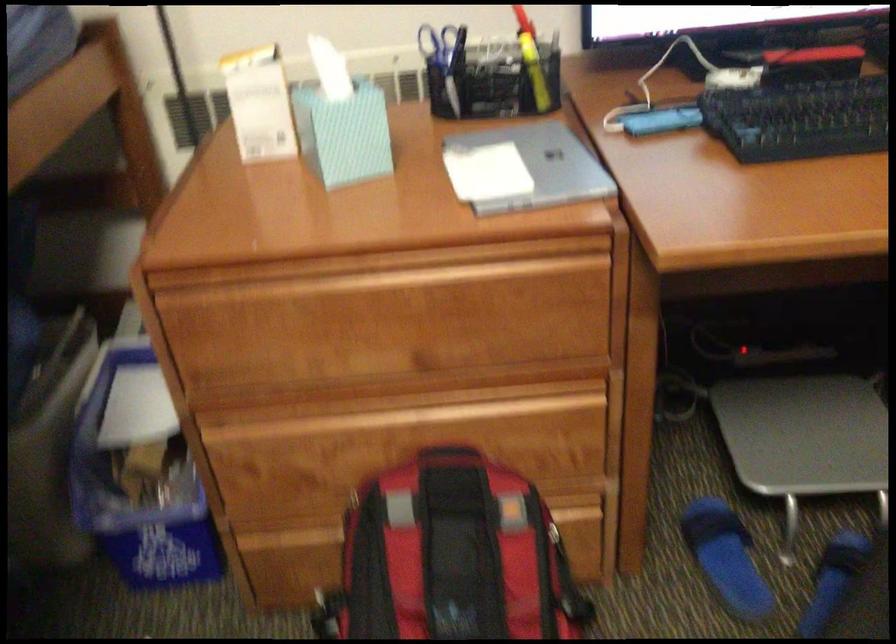
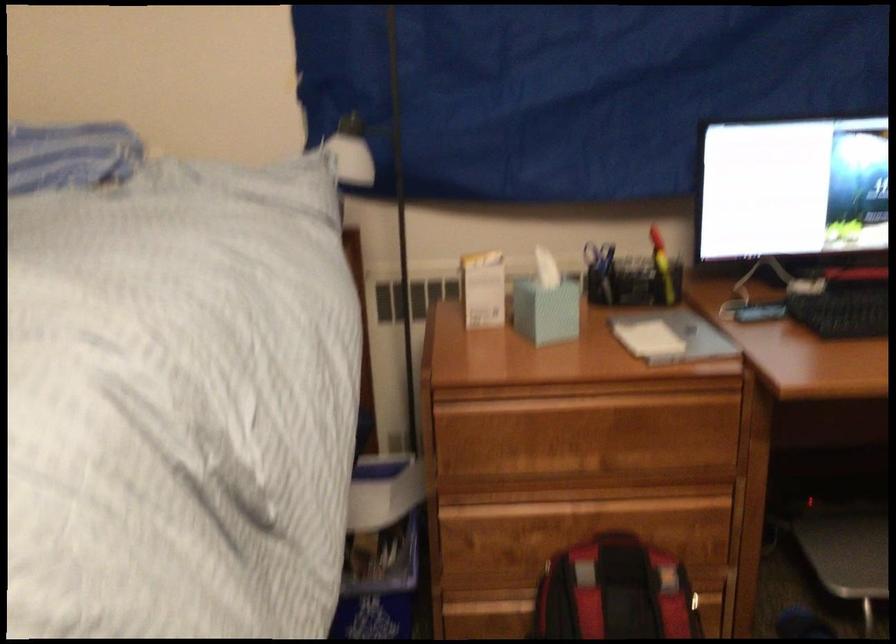
Find the pixel in the second image that matches pixel 330 76 in the first image.

(545, 270)